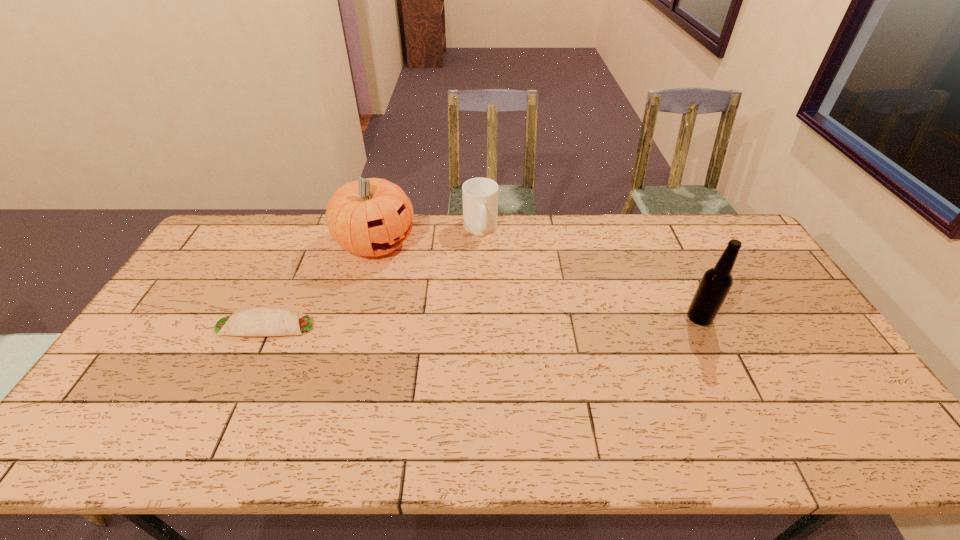
The image size is (960, 540). I want to click on vacant area that lies between the pumpkin and the burrito, so click(x=321, y=284).

Find the location of a particular element. This screenshot has width=960, height=540. empty space between the rightmost object and the burrito is located at coordinates (482, 322).

The image size is (960, 540). In order to click on vacant region between the second object from right to left and the pumpkin in this screenshot , I will do `click(428, 235)`.

The height and width of the screenshot is (540, 960). Find the location of `free spot between the shortest object and the second object from right to left`. free spot between the shortest object and the second object from right to left is located at coordinates (372, 277).

I want to click on empty location between the second shortest object and the rightmost object, so [589, 273].

The image size is (960, 540). I want to click on vacant area between the pumpkin and the burrito, so click(x=321, y=284).

This screenshot has width=960, height=540. I want to click on vacant point located between the third tallest object and the burrito, so click(x=372, y=277).

Where is `vacant area between the pumpkin and the mug`? This screenshot has width=960, height=540. vacant area between the pumpkin and the mug is located at coordinates (428, 235).

Find the location of a particular element. The height and width of the screenshot is (540, 960). unoccupied position between the pumpkin and the third tallest object is located at coordinates (428, 235).

Locate which object is the third closest to the mug. Please provide its 2D coordinates. Your answer should be formatted as a tuple, i.e. [(x, y)], where the tuple contains the x and y coordinates of a point satisfying the conditions above.

[(716, 282)]